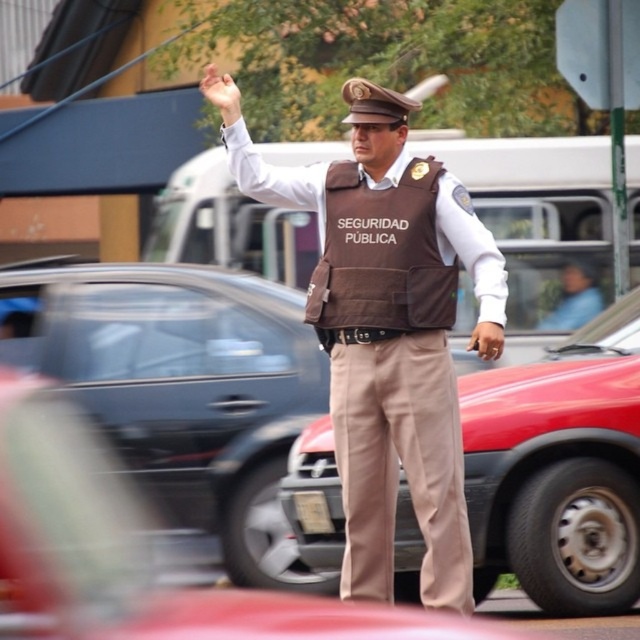
Question: Does brown leather pants at center appear on the left side of brown leather vest at center?

Choices:
 (A) yes
 (B) no

Answer: (B)

Question: Which object is positioned farthest from the brown leather vest at center?

Choices:
 (A) brown fabric vest at center
 (B) brown leather pants at center

Answer: (B)

Question: Which object appears closest to the camera in this image?

Choices:
 (A) brown fabric vest at center
 (B) brown leather pants at center
 (C) brown leather vest at center

Answer: (C)

Question: From the image, what is the correct spatial relationship of brown leather pants at center in relation to brown fabric vest at center?

Choices:
 (A) left
 (B) right

Answer: (B)

Question: Is brown leather vest at center bigger than brown fabric vest at center?

Choices:
 (A) yes
 (B) no

Answer: (A)

Question: Estimate the real-world distances between objects in this image. Which object is closer to the brown fabric vest at center?

Choices:
 (A) brown leather pants at center
 (B) brown leather vest at center

Answer: (B)